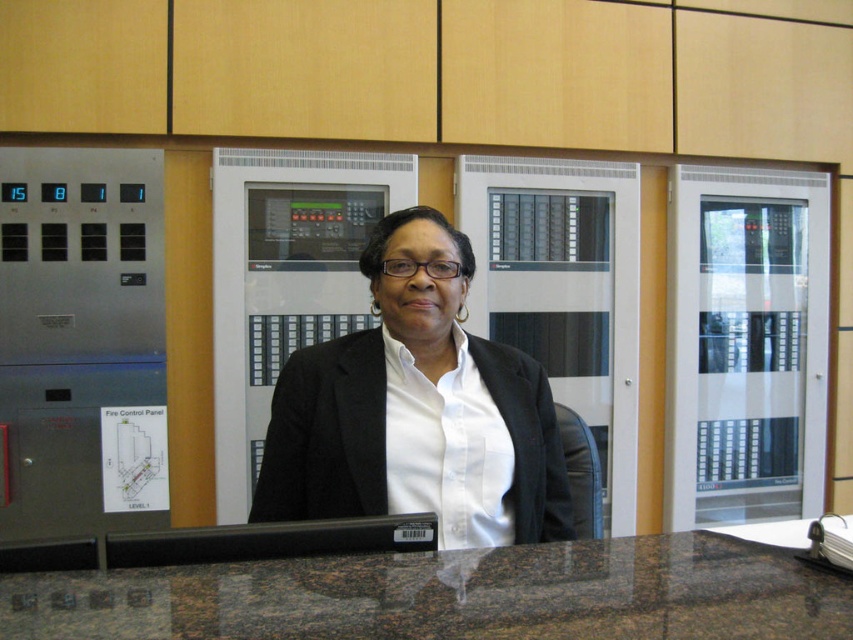
Consider the image. Can you confirm if brown granite table at center is shorter than white matte blazer at center?

Indeed, brown granite table at center has a lesser height compared to white matte blazer at center.

Is brown granite table at center taller than white matte blazer at center?

No, brown granite table at center is not taller than white matte blazer at center.

Is point (42, 588) less distant than point (416, 337)?

Yes, point (42, 588) is closer to viewer.

Locate an element on the screen. This screenshot has width=853, height=640. brown granite table at center is located at coordinates (450, 595).